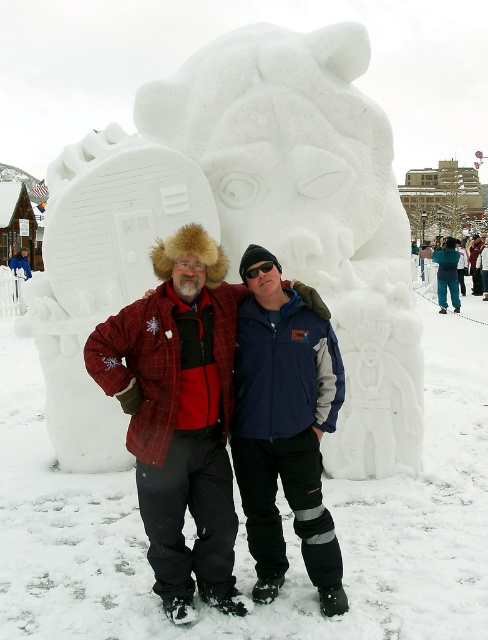
Question: Among these points, which one is nearest to the camera?

Choices:
 (A) pos(310,419)
 (B) pos(482,285)

Answer: (A)

Question: In this image, where is navy blue jacket at center located relative to blue fleece jacket at center?

Choices:
 (A) above
 (B) below

Answer: (B)

Question: Among these objects, which one is nearest to the camera?

Choices:
 (A) navy blue jacket at center
 (B) white snow sculpture at center
 (C) blue fleece jacket at center

Answer: (A)

Question: Does plaid wool jacket at center have a larger size compared to navy blue jacket at center?

Choices:
 (A) yes
 (B) no

Answer: (A)

Question: Which point is farther to the camera?

Choices:
 (A) (215, 289)
 (B) (300, 412)
 (C) (420, 362)
 (D) (482, 244)

Answer: (D)

Question: Is white snow sculpture at center above navy blue jacket at center?

Choices:
 (A) yes
 (B) no

Answer: (A)